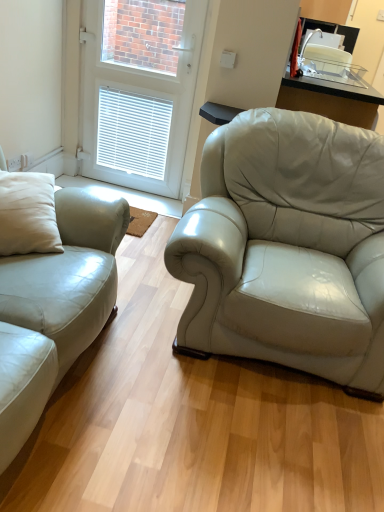
Question: From the image's perspective, relative to satin white leather couch at left, is white glossy door at upper center above or below?

Choices:
 (A) above
 (B) below

Answer: (A)

Question: Is point (122, 10) closer or farther from the camera than point (71, 266)?

Choices:
 (A) closer
 (B) farther

Answer: (B)

Question: Choose the correct answer: Is white glossy door at upper center inside satin white leather couch at left or outside it?

Choices:
 (A) inside
 (B) outside

Answer: (B)

Question: Do you think satin white leather couch at left is within white glossy door at upper center, or outside of it?

Choices:
 (A) outside
 (B) inside

Answer: (A)

Question: Based on their positions, is satin white leather couch at left located to the left or right of white glossy door at upper center?

Choices:
 (A) right
 (B) left

Answer: (B)

Question: In the image, is satin white leather couch at left positioned in front of or behind white glossy door at upper center?

Choices:
 (A) front
 (B) behind

Answer: (A)

Question: From their relative heights in the image, would you say satin white leather couch at left is taller or shorter than white glossy door at upper center?

Choices:
 (A) tall
 (B) short

Answer: (B)